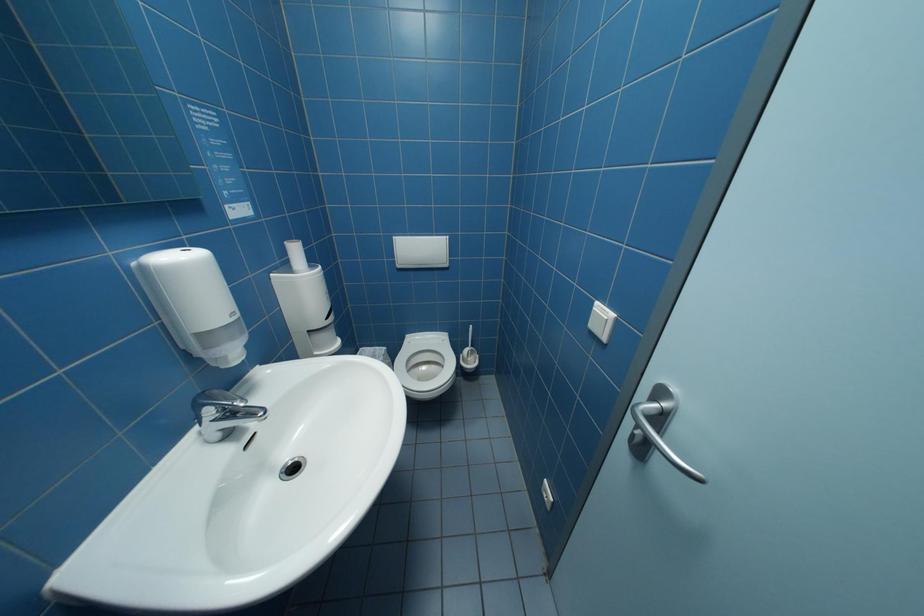
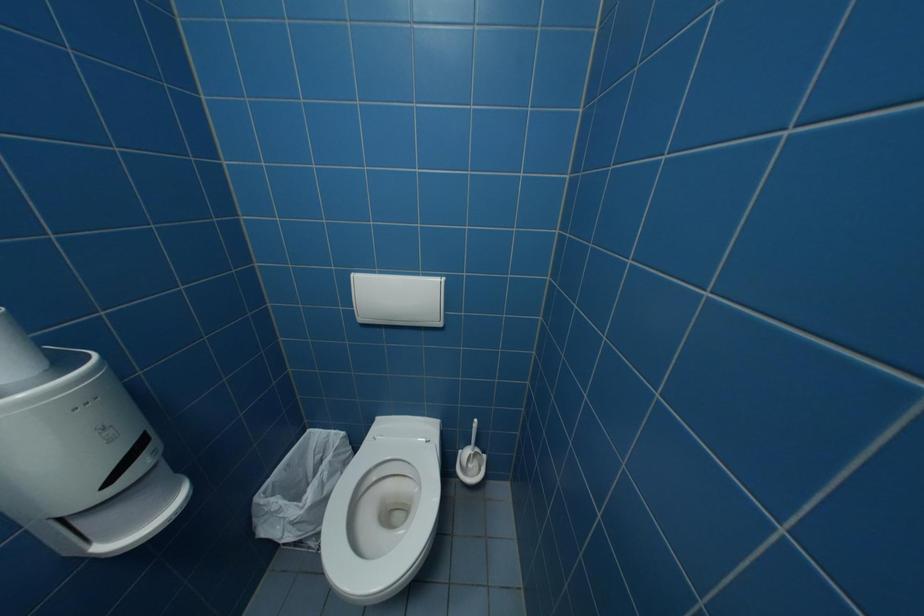
Question: The first image is from the beginning of the video and the second image is from the end. How did the camera likely rotate when shooting the video?

Choices:
 (A) Left
 (B) Right
 (C) Up
 (D) Down

Answer: (A)